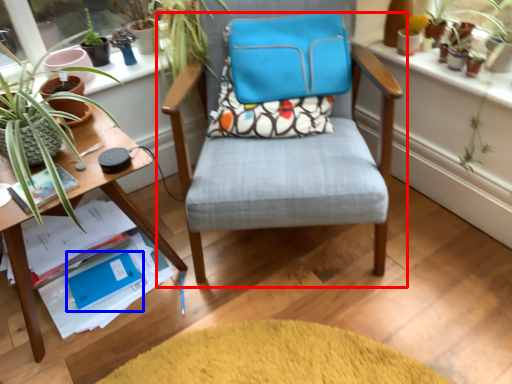
Question: Among these objects, which one is nearest to the camera, chair (highlighted by a red box) or paperback book (highlighted by a blue box)?

Choices:
 (A) chair
 (B) paperback book

Answer: (A)